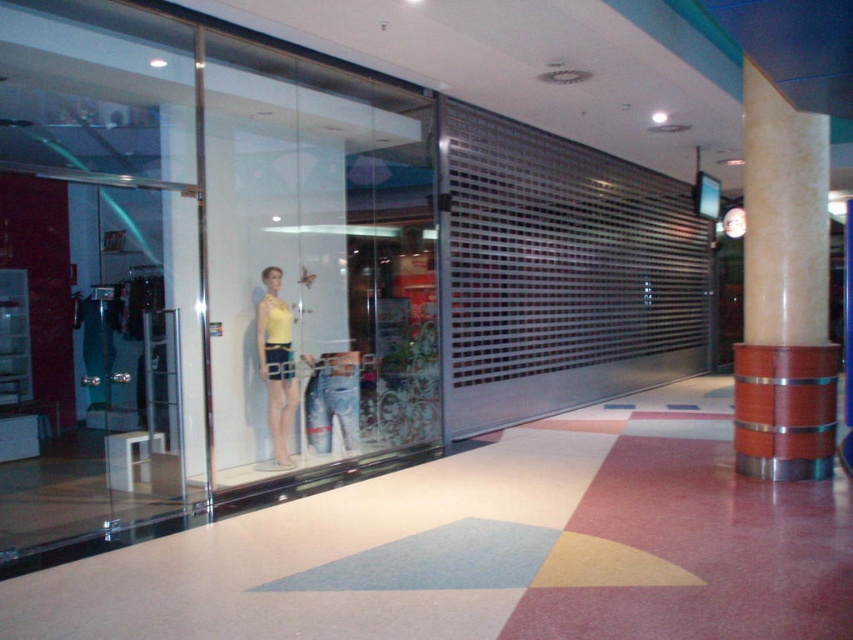
Question: Which of the following is the farthest from the observer?

Choices:
 (A) transparent glass shop window at left
 (B) matte yellow blouse at center

Answer: (B)

Question: Which is nearer to the matte yellow blouse at center?

Choices:
 (A) wooden column at right
 (B) transparent glass shop window at left

Answer: (B)

Question: Estimate the real-world distances between objects in this image. Which object is farther from the wooden column at right?

Choices:
 (A) matte yellow blouse at center
 (B) transparent glass shop window at left

Answer: (B)

Question: Does transparent glass shop window at left appear on the right side of wooden column at right?

Choices:
 (A) yes
 (B) no

Answer: (B)

Question: Can you confirm if wooden column at right is positioned above matte yellow blouse at center?

Choices:
 (A) yes
 (B) no

Answer: (A)

Question: Is transparent glass shop window at left above wooden column at right?

Choices:
 (A) no
 (B) yes

Answer: (A)